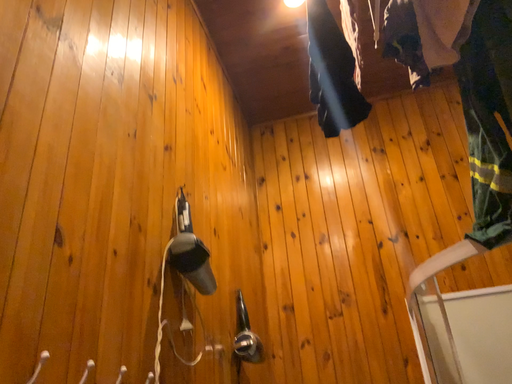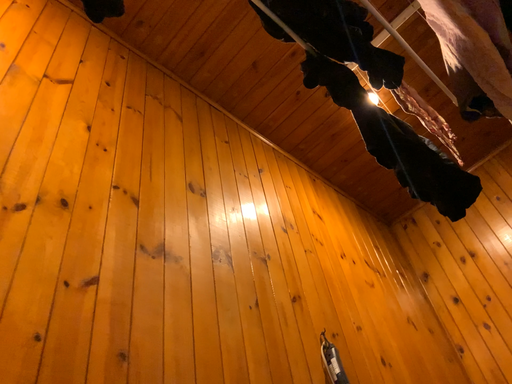
Question: How did the camera likely rotate when shooting the video?

Choices:
 (A) rotated left
 (B) rotated right

Answer: (A)